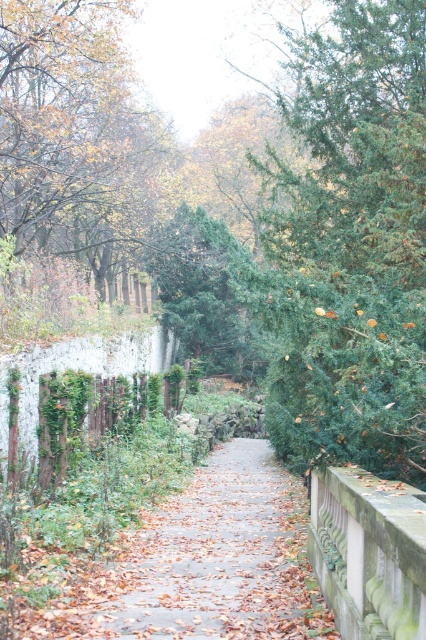
You are standing at the center of the pathway in the image. You want to walk towards the brown leafy tree at upper left located at point (74, 132). What direction should you face to walk directly towards it?

You should face towards the upper left direction to walk directly towards the brown leafy tree at upper left located at point (74, 132).

You are a gardener who needs to prune plants in the garden. You see the green textured tree at center and the stone balustrade at right. Which object is bigger in size?

The green textured tree at center is larger in size compared to the stone balustrade at right, so the green textured tree at center is bigger.

Looking at this image, you are standing at the center of the pathway and want to take a photo that includes both the brown leafy tree at upper left and the stone balustrade at right. Given their distance apart, will they both fit in the frame of your camera which has a 60 feet field of view?

The brown leafy tree at upper left is 67.87 feet away from the stone balustrade at right. Since the camera has a 60 feet field of view, the distance between them exceeds the camera field of view, so they won not both fit in the frame.